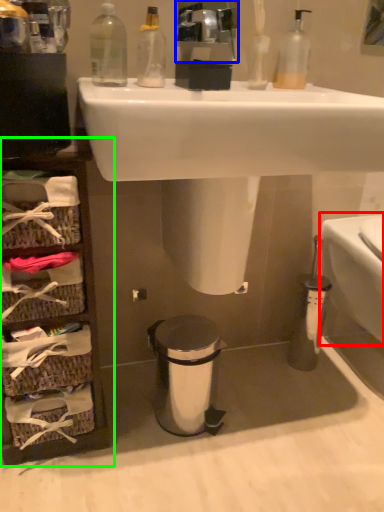
Question: Which object is positioned closest to toilet bowl (highlighted by a red box)? Select from mirror (highlighted by a blue box) and cabinet (highlighted by a green box).

Choices:
 (A) mirror
 (B) cabinet

Answer: (A)